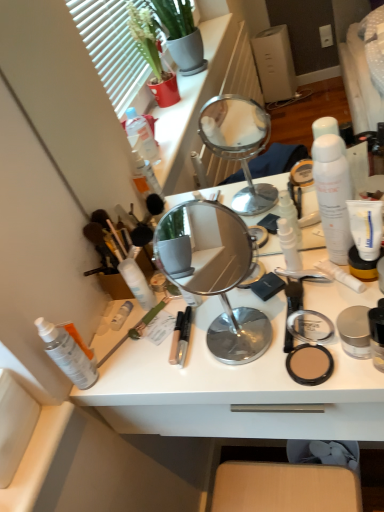
Find the location of a particular element. The height and width of the screenshot is (512, 384). empty space that is in between white matte spray can at left, marked as the fifth toiletry in a right-to-left arrangement, and white matte tube at right, acting as the first toothpaste starting from the top is located at coordinates pyautogui.click(x=218, y=320).